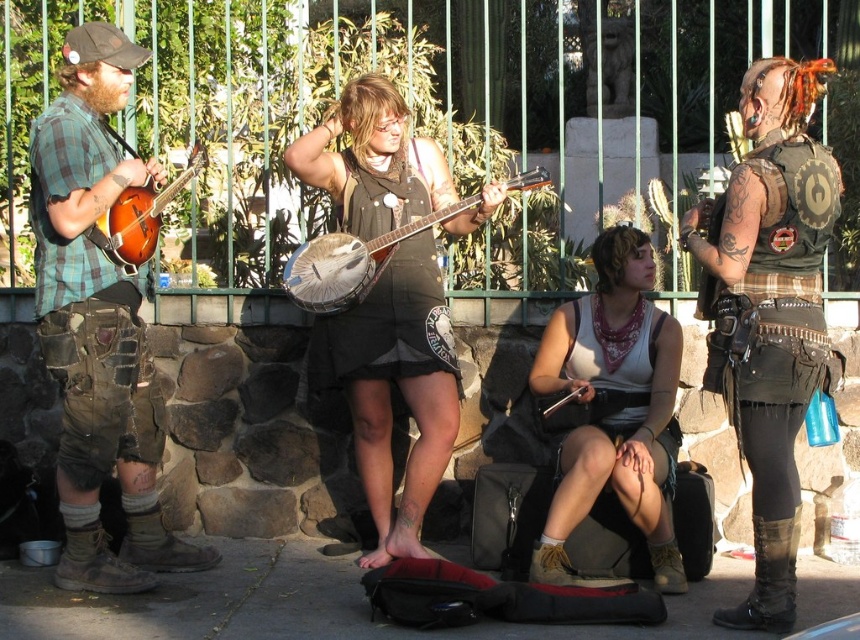
Question: Among these points, which one is farthest from the camera?

Choices:
 (A) (71, 524)
 (B) (115, 232)
 (C) (809, 93)

Answer: (B)

Question: Which object is closer to the camera taking this photo?

Choices:
 (A) matte brown banjo at left
 (B) matte plaid shirt at left

Answer: (B)

Question: Is steampunk leather vest at center below smooth concrete pavement at lower center?

Choices:
 (A) no
 (B) yes

Answer: (A)

Question: Which object is positioned farthest from the wooden banjo at center?

Choices:
 (A) smooth concrete pavement at lower center
 (B) white fabric tank top at center

Answer: (A)

Question: Is matte plaid shirt at left wider than matte brown banjo at left?

Choices:
 (A) no
 (B) yes

Answer: (B)

Question: Observing the image, what is the correct spatial positioning of matte plaid shirt at left in reference to smooth concrete pavement at lower center?

Choices:
 (A) left
 (B) right

Answer: (B)